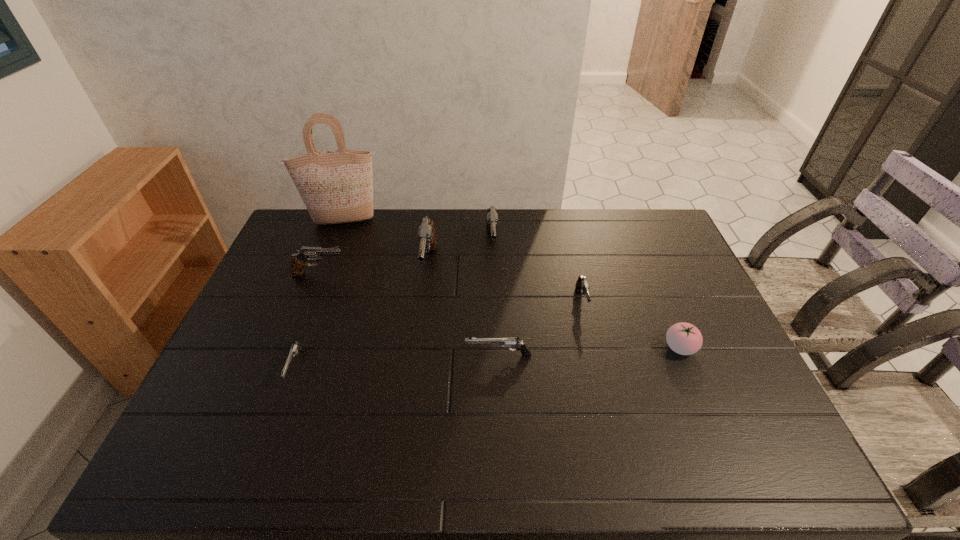
The image size is (960, 540). What are the coordinates of `tomato` in the screenshot? It's located at (683, 338).

This screenshot has width=960, height=540. I want to click on the right silver pistol, so click(x=505, y=342).

What are the coordinates of `the bigger silver pistol` in the screenshot? It's located at (505, 342).

Locate an element on the screen. This screenshot has width=960, height=540. the shortest pistol is located at coordinates (295, 347).

The image size is (960, 540). I want to click on the smaller silver pistol, so click(x=295, y=347).

Locate an element on the screen. The image size is (960, 540). vacant space located 0.260m on the right of the tallest object is located at coordinates (455, 221).

In order to click on vacant space situated at the barrel of the tallest pistol in this screenshot , I will do `click(416, 364)`.

In order to click on vacant space situated at the barrel of the second biggest gray pistol in this screenshot , I will do `click(493, 303)`.

Image resolution: width=960 pixels, height=540 pixels. I want to click on free space located 0.270m at the barrel of the third biggest gray pistol, so click(429, 274).

Where is `vacant space situated at the barrel of the seventh object from left to right`? This screenshot has height=540, width=960. vacant space situated at the barrel of the seventh object from left to right is located at coordinates pyautogui.click(x=588, y=331).